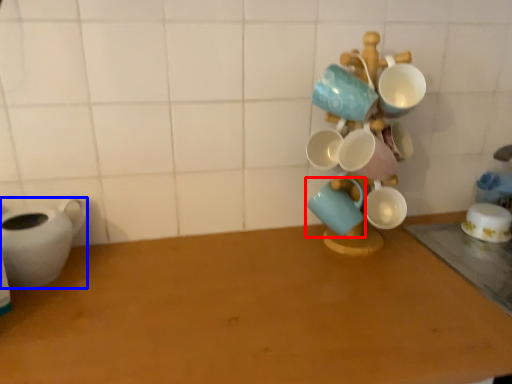
Question: Which object is further to the camera taking this photo, coffee cup (highlighted by a red box) or tableware (highlighted by a blue box)?

Choices:
 (A) coffee cup
 (B) tableware

Answer: (A)